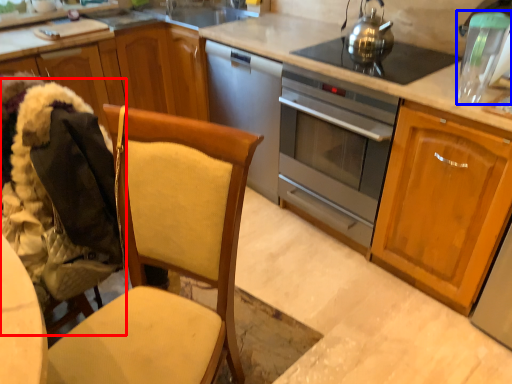
Question: Which object is further to the camera taking this photo, folding chair (highlighted by a red box) or appliance (highlighted by a blue box)?

Choices:
 (A) folding chair
 (B) appliance

Answer: (B)